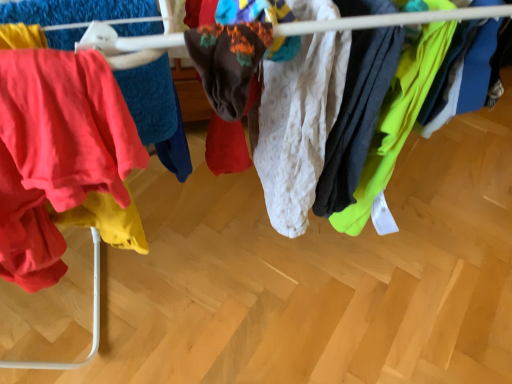
Question: Is white textured fabric at center, the second clothing from the left, wider or thinner than white textured fabric at center, which appears as the second clothing when viewed from the right?

Choices:
 (A) thin
 (B) wide

Answer: (B)

Question: Does point (430, 56) appear closer or farther from the camera than point (321, 57)?

Choices:
 (A) closer
 (B) farther

Answer: (B)

Question: From a real-world perspective, is white textured fabric at center, positioned as the 1th clothing in right-to-left order, above or below white textured fabric at center, which appears as the second clothing when viewed from the right?

Choices:
 (A) below
 (B) above

Answer: (B)

Question: Looking at their shapes, would you say white textured fabric at center, which appears as the second clothing when viewed from the right, is wider or thinner than white textured fabric at center, positioned as the 1th clothing in right-to-left order?

Choices:
 (A) wide
 (B) thin

Answer: (B)

Question: Looking at the image, does white textured fabric at center, which appears as the second clothing when viewed from the right, seem bigger or smaller compared to white textured fabric at center, the second clothing from the left?

Choices:
 (A) big
 (B) small

Answer: (A)

Question: From a real-world perspective, relative to white textured fabric at center, positioned as the 1th clothing in right-to-left order, is white textured fabric at center, which appears as the 1th clothing when viewed from the left, vertically above or below?

Choices:
 (A) below
 (B) above

Answer: (A)

Question: Is white textured fabric at center, which appears as the second clothing when viewed from the right, situated inside white textured fabric at center, the second clothing from the left, or outside?

Choices:
 (A) inside
 (B) outside

Answer: (B)